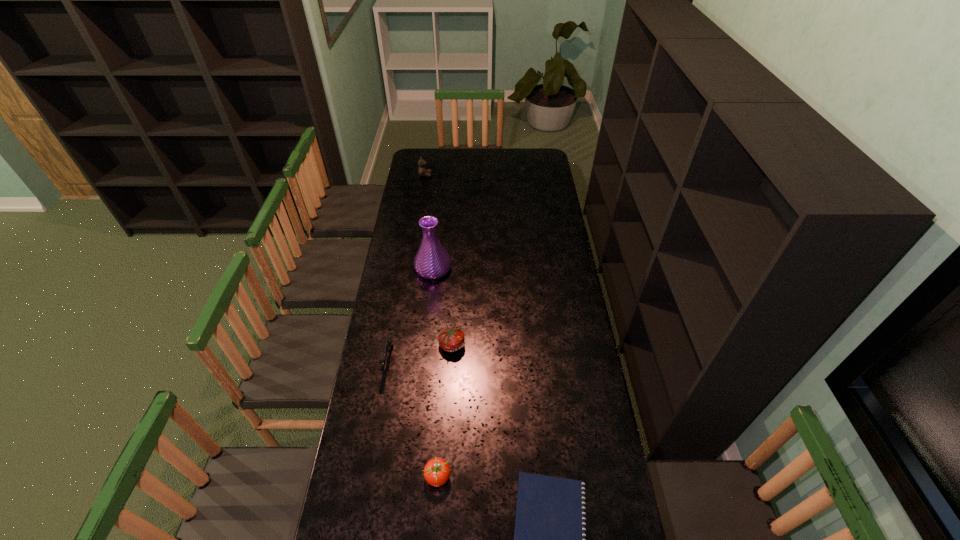
I want to click on free space located 0.060m on the back of the nearer tomato, so click(x=441, y=445).

This screenshot has width=960, height=540. Find the location of `vase located at the left edge`. vase located at the left edge is located at coordinates (432, 261).

The width and height of the screenshot is (960, 540). In order to click on teddy bear that is positioned at the left edge in this screenshot , I will do `click(422, 170)`.

Find the location of `gun that is at the left edge`. gun that is at the left edge is located at coordinates (389, 342).

What are the coordinates of `free space at the far edge of the desktop` in the screenshot? It's located at (494, 159).

I want to click on vacant area at the left edge of the desktop, so click(351, 532).

Where is `vacant space at the right edge of the desktop`? vacant space at the right edge of the desktop is located at coordinates (547, 190).

At what (x,y) coordinates should I click in order to perform the action: click on free space at the far right corner of the desktop. Please return your answer as a coordinate pair (x, y). The height and width of the screenshot is (540, 960). Looking at the image, I should click on (549, 158).

Find the location of a particular element. The image size is (960, 540). vacant area that lies between the nearer tomato and the farther tomato is located at coordinates (445, 410).

Locate an element on the screen. This screenshot has width=960, height=540. free spot between the farther tomato and the nearer tomato is located at coordinates (445, 410).